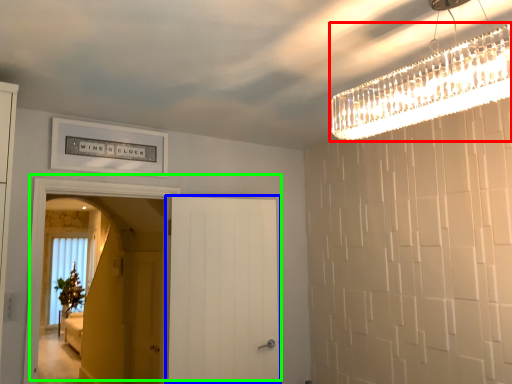
Question: Estimate the real-world distances between objects in this image. Which object is closer to light fixture (highlighted by a red box), door (highlighted by a blue box) or door (highlighted by a green box)?

Choices:
 (A) door
 (B) door

Answer: (A)